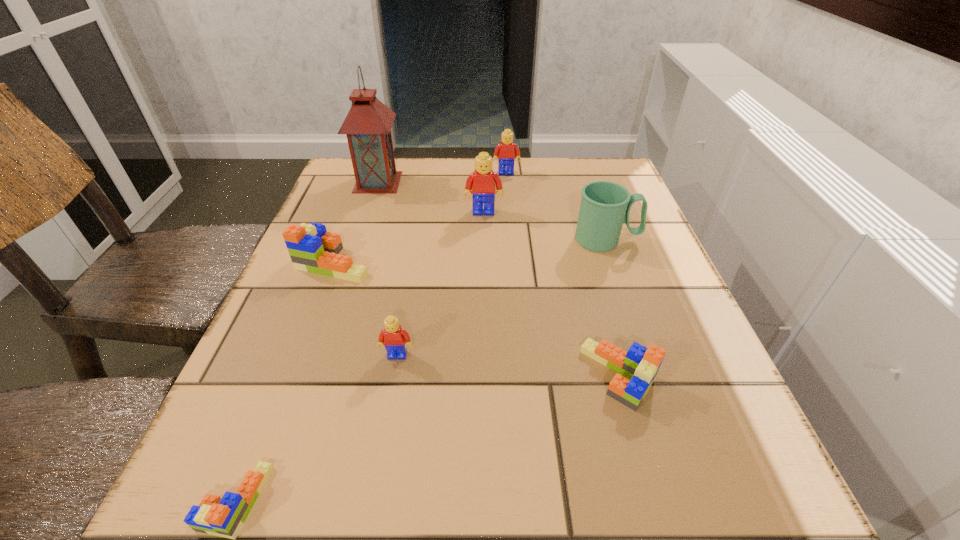
At what (x,y) coordinates should I click in order to perform the action: click on free region at the far edge of the desktop. Please return your answer as a coordinate pair (x, y). The height and width of the screenshot is (540, 960). Looking at the image, I should click on (453, 177).

In the image, there is a desktop. Where is `free region at the near edge`? This screenshot has width=960, height=540. free region at the near edge is located at coordinates (471, 495).

I want to click on free region at the left edge of the desktop, so click(x=364, y=245).

Identify the location of vacant space at the right edge of the desktop. (641, 422).

Where is `free space at the far left corner of the desktop`? The width and height of the screenshot is (960, 540). free space at the far left corner of the desktop is located at coordinates (396, 159).

Find the location of `empty space between the fifth shortest Lego and the smallest yellow Lego`. empty space between the fifth shortest Lego and the smallest yellow Lego is located at coordinates (452, 264).

This screenshot has height=540, width=960. Find the location of `empty space that is in between the farthest yellow Lego and the nearest object`. empty space that is in between the farthest yellow Lego and the nearest object is located at coordinates (371, 336).

In order to click on vacant space that is in between the third farthest Lego and the second smallest orange Lego in this screenshot , I will do `click(477, 319)`.

The image size is (960, 540). I want to click on vacant space that is in between the tallest object and the second smallest orange Lego, so click(498, 279).

You are a GUI agent. You are given a task and a screenshot of the screen. Output one action in this format:
    pyautogui.click(x=<x>, y=<y>)
    Task: Click on the free space between the sixth nearest object and the tallest object
    The height and width of the screenshot is (540, 960).
    Given the screenshot: What is the action you would take?
    pyautogui.click(x=431, y=197)